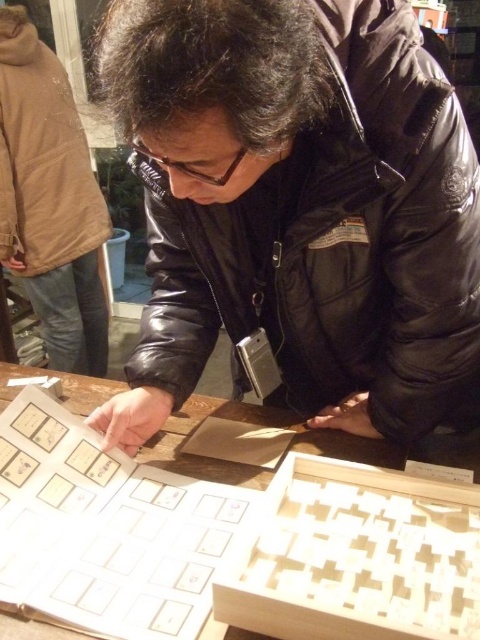
You are standing in the room and want to determine which of the two points, point (372, 48) or point (119, 388), is closer to you. Based on the scene description, which point is nearer?

Point (372, 48) is closer to the viewer than point (119, 388).

You are a delivery person who needs to place a package that is 12 inches long on the table. Can you fit the package between the black leather jacket at center and the edge of the wooden table at center?

The distance between the black leather jacket at center and the wooden table at center is 10.07 inches, which is shorter than the 12 inch package. Therefore, the package cannot be placed there.

You are standing in the room and want to pick up the black leather jacket at center. Can you reach it without moving the wooden table at center?

The black leather jacket at center is closer to the viewer than the wooden table at center, so yes, you can reach it without moving the wooden table at center since it is nearer to you.